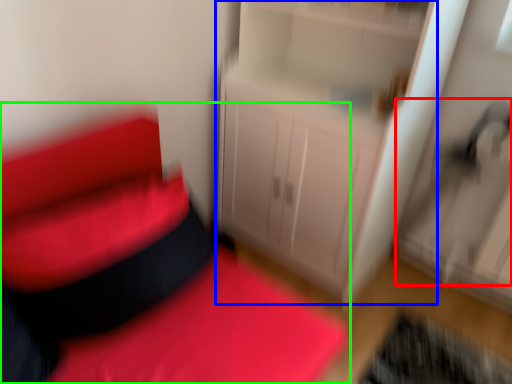
Question: Estimate the real-world distances between objects in this image. Which object is closer to swivel chair (highlighted by a red box), dresser (highlighted by a blue box) or furniture (highlighted by a green box)?

Choices:
 (A) dresser
 (B) furniture

Answer: (A)